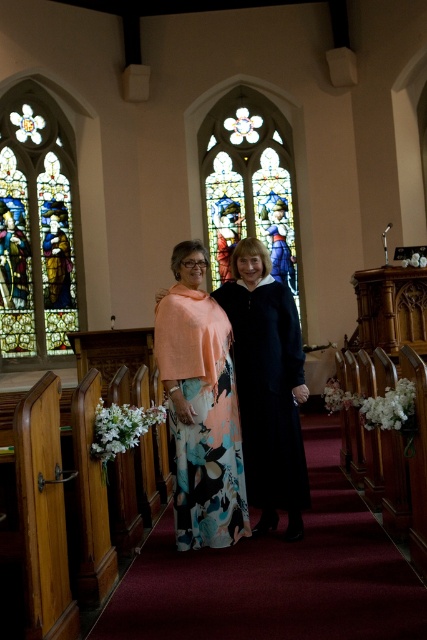
Question: Does black satin dress at center appear over stained glass window at center?

Choices:
 (A) no
 (B) yes

Answer: (A)

Question: Based on their relative distances, which object is farther from the stained glass window at center?

Choices:
 (A) black satin dress at center
 (B) stained glass window at left
 (C) floral-patterned fabric at center
 (D) floral-patterned fabric dress at center

Answer: (A)

Question: Which of the following is the closest to the observer?

Choices:
 (A) floral-patterned fabric dress at center
 (B) stained glass window at center
 (C) stained glass window at left
 (D) black satin dress at center

Answer: (A)

Question: Is black satin dress at center positioned in front of stained glass window at center?

Choices:
 (A) yes
 (B) no

Answer: (A)

Question: Estimate the real-world distances between objects in this image. Which object is farther from the black satin dress at center?

Choices:
 (A) floral-patterned fabric at center
 (B) stained glass window at center
 (C) floral-patterned fabric dress at center

Answer: (B)

Question: Does floral-patterned fabric dress at center appear under black satin dress at center?

Choices:
 (A) no
 (B) yes

Answer: (A)